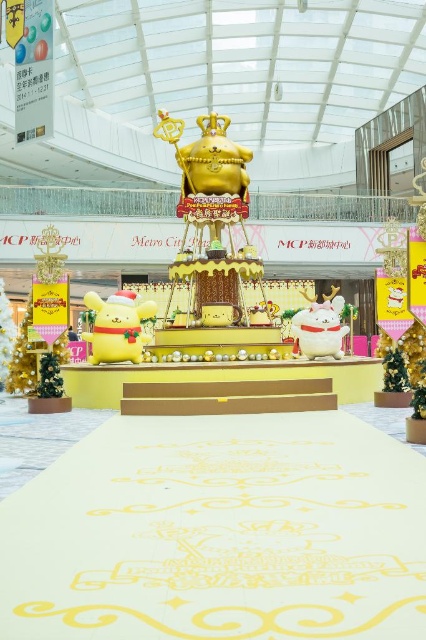
Question: Which of the following is the farthest from the observer?

Choices:
 (A) white plush cat at center
 (B) yellow plush toy at center

Answer: (A)

Question: Which of the following is the closest to the observer?

Choices:
 (A) (337, 305)
 (B) (83, 300)

Answer: (A)

Question: Does yellow plush toy at center lie behind white plush cat at center?

Choices:
 (A) no
 (B) yes

Answer: (A)

Question: Among these points, which one is farthest from the camera?

Choices:
 (A) (345, 332)
 (B) (109, 317)

Answer: (A)

Question: In this image, where is yellow plush toy at center located relative to white plush cat at center?

Choices:
 (A) above
 (B) below

Answer: (B)

Question: Does yellow plush toy at center appear under white plush cat at center?

Choices:
 (A) no
 (B) yes

Answer: (B)